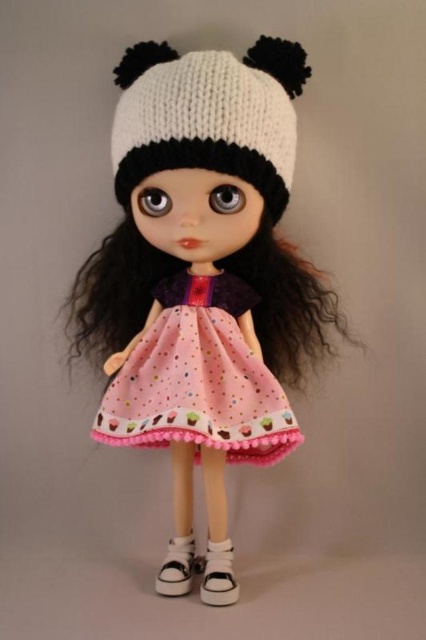
How much distance is there between white knitted hat at center and white canvas sneaker at lower center?

white knitted hat at center and white canvas sneaker at lower center are 32.44 inches apart.

Does white knitted hat at center have a larger size compared to white canvas sneaker at lower center?

Yes.

Who is more distant from viewer, (279, 170) or (190, 550)?

The point (190, 550) is more distant.

Where is `white knitted hat at center`? The width and height of the screenshot is (426, 640). white knitted hat at center is located at coordinates (209, 115).

Does matte white knit hat at upper center have a greater height compared to white canvas sneaker at lower center?

Yes.

What do you see at coordinates (203, 266) in the screenshot? This screenshot has height=640, width=426. I see `matte white knit hat at upper center` at bounding box center [203, 266].

Who is more forward, (141, 273) or (186, 564)?

Point (186, 564)

Locate an element on the screen. matte white knit hat at upper center is located at coordinates (203, 266).

Between matte white knit hat at upper center and pink fabric dress at center, which one has less height?

Standing shorter between the two is pink fabric dress at center.

Can you confirm if matte white knit hat at upper center is wider than pink fabric dress at center?

Correct, the width of matte white knit hat at upper center exceeds that of pink fabric dress at center.

Does point (236, 225) come behind point (204, 314)?

No, (236, 225) is closer to viewer.

Where is `matte white knit hat at upper center`? matte white knit hat at upper center is located at coordinates (203, 266).